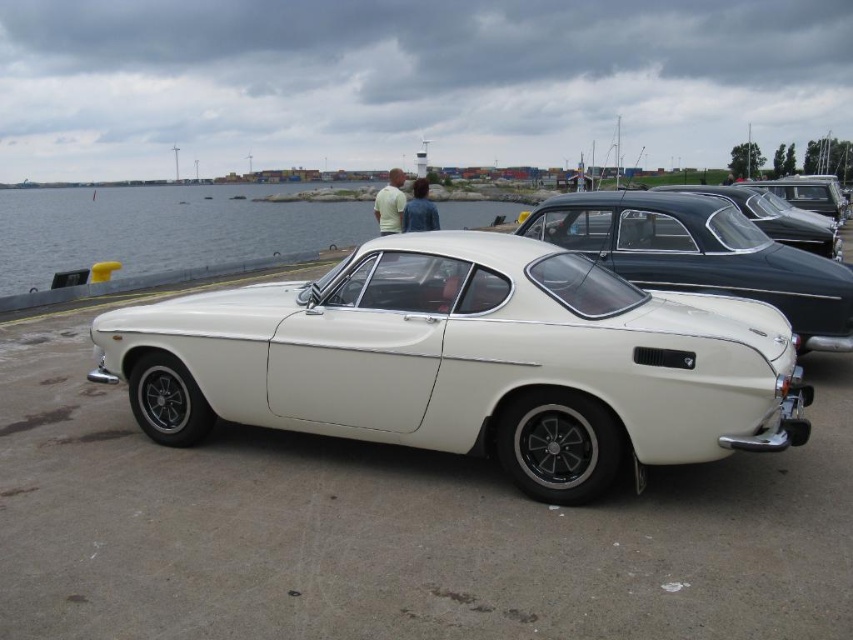
The image size is (853, 640). Describe the element at coordinates (775, 218) in the screenshot. I see `shiny black car at center` at that location.

Can you confirm if shiny black car at center is shorter than shiny black car at right?

Yes, shiny black car at center is shorter than shiny black car at right.

Does point (772, 220) come farther from viewer compared to point (784, 186)?

No, it is not.

The image size is (853, 640). I want to click on shiny black car at center, so click(775, 218).

Is point (659, 275) positioned behind point (761, 180)?

No.

Does point (596, 253) come farther from viewer compared to point (776, 196)?

No.

Locate an element on the screen. Image resolution: width=853 pixels, height=640 pixels. white matte car at center is located at coordinates (701, 253).

Is clear water at center wider than white matte car at center?

Correct, the width of clear water at center exceeds that of white matte car at center.

Does clear water at center have a greater height compared to white matte car at center?

Correct, clear water at center is much taller as white matte car at center.

What do you see at coordinates (160, 228) in the screenshot? I see `clear water at center` at bounding box center [160, 228].

What are the coordinates of `clear water at center` in the screenshot? It's located at (160, 228).